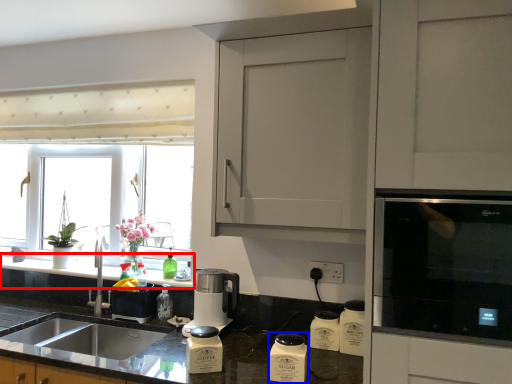
Question: Which of the following is the farthest to the observer, countertop (highlighted by a red box) or appliance (highlighted by a blue box)?

Choices:
 (A) countertop
 (B) appliance

Answer: (A)